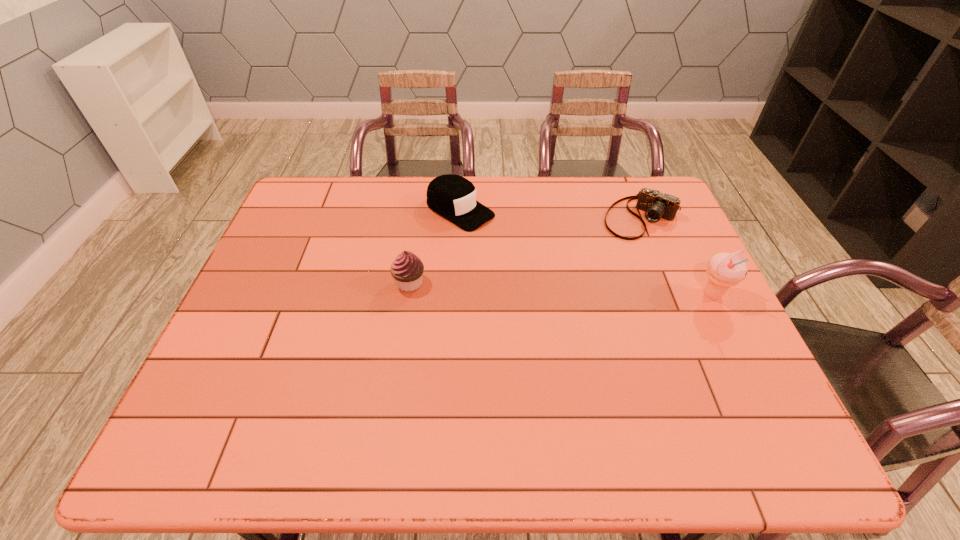
You are a GUI agent. You are given a task and a screenshot of the screen. Output one action in this format:
    pyautogui.click(x=<x>, y=<y>)
    Task: Click on the vacant space at the right edge of the desktop
    The image size is (960, 540).
    Given the screenshot: What is the action you would take?
    pyautogui.click(x=732, y=326)

Where is `blank area at the far left corner`? Image resolution: width=960 pixels, height=540 pixels. blank area at the far left corner is located at coordinates (289, 219).

In order to click on vacant space at the near right corner in this screenshot , I will do `click(698, 388)`.

Where is `blank region between the camera and the cupcake`? blank region between the camera and the cupcake is located at coordinates (525, 251).

The height and width of the screenshot is (540, 960). I want to click on unoccupied area between the tallest object and the shortest object, so click(677, 256).

This screenshot has height=540, width=960. Identify the location of empty location between the shortest object and the cupcake. (525, 251).

The image size is (960, 540). Identify the location of free spot between the camera and the cupcake. (525, 251).

Identify the location of free point between the icecream and the camera. The image size is (960, 540). (677, 256).

What are the coordinates of `free area in between the cupcake and the cap` in the screenshot? It's located at (435, 247).

You are a GUI agent. You are given a task and a screenshot of the screen. Output one action in this format:
    pyautogui.click(x=<x>, y=<y>)
    Task: Click on the free point between the third tallest object and the camera
    
    Given the screenshot: What is the action you would take?
    pyautogui.click(x=551, y=214)